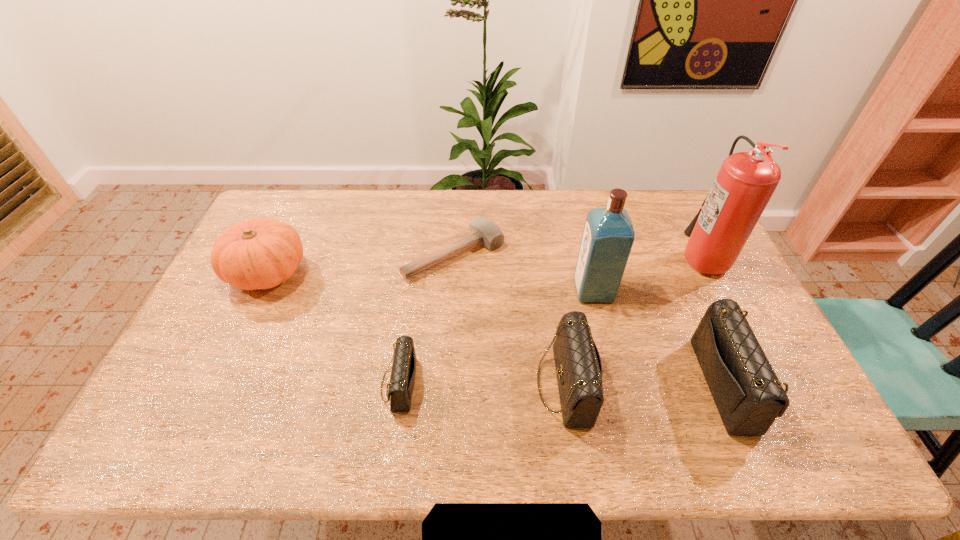
The height and width of the screenshot is (540, 960). Identify the location of vacant space located 0.160m on the front flap of the sixth tallest object. (319, 384).

You are a GUI agent. You are given a task and a screenshot of the screen. Output one action in this format:
    pyautogui.click(x=<x>, y=<y>)
    Task: Click on the vacant space situated 0.230m on the front flap of the sixth tallest object
    
    Given the screenshot: What is the action you would take?
    pyautogui.click(x=292, y=384)

This screenshot has height=540, width=960. Find the location of `free region located on the front flap of the sixth tallest object`. free region located on the front flap of the sixth tallest object is located at coordinates tap(292, 384).

Locate an element on the screen. The width and height of the screenshot is (960, 540). vacant space located 0.070m on the front flap of the fourth object from left to right is located at coordinates (510, 384).

Where is `free space located on the front flap of the fourth object from left to right`? free space located on the front flap of the fourth object from left to right is located at coordinates (413, 384).

Locate an element on the screen. The height and width of the screenshot is (540, 960). free space located on the front flap of the fourth object from left to right is located at coordinates (502, 384).

The width and height of the screenshot is (960, 540). Identify the location of vacant space located 0.230m on the instruction side of the tallest object. (611, 255).

Identify the location of vacant area situated on the instruction side of the tallest object. The width and height of the screenshot is (960, 540). (584, 255).

This screenshot has height=540, width=960. What are the coordinates of `free space located 0.050m on the instruction side of the tallest object` in the screenshot? It's located at (664, 255).

Locate an element on the screen. The width and height of the screenshot is (960, 540). free point located 0.070m on the front of the mallet is located at coordinates (451, 301).